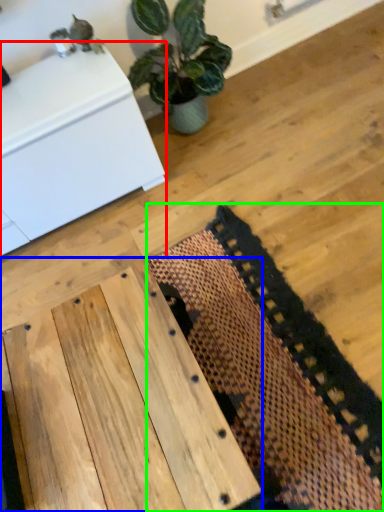
Question: Which is nearer to the furniture (highlighted by a red box)? table (highlighted by a blue box) or mat (highlighted by a green box).

Choices:
 (A) table
 (B) mat

Answer: (B)